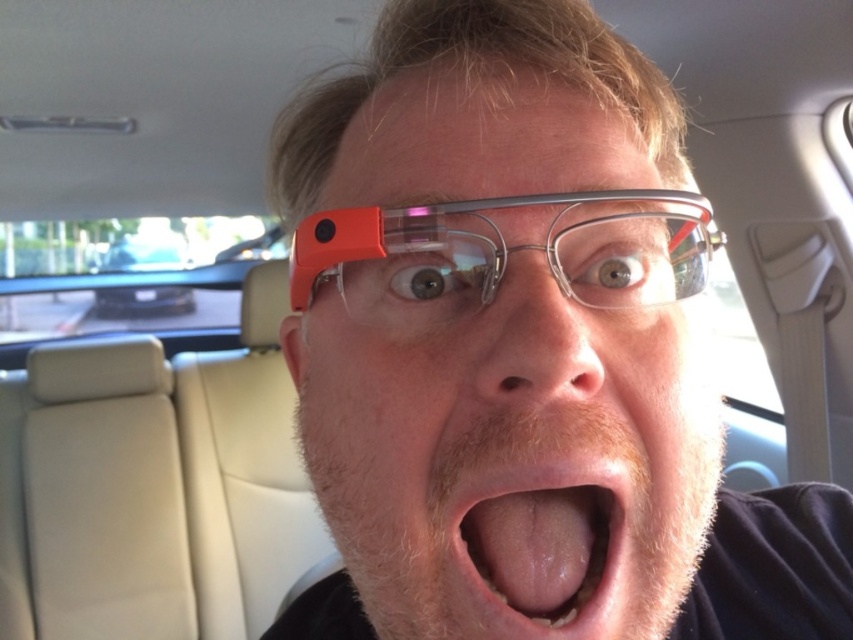
Based on the photo, is orange plastic google glass at center smaller than pink flesh at center?

No.

How far apart are orange plastic google glass at center and pink flesh at center?

A distance of 3.29 inches exists between orange plastic google glass at center and pink flesh at center.

Does point (685, 292) come closer to viewer compared to point (607, 518)?

That is False.

Find the location of a particular element. This screenshot has height=640, width=853. orange plastic google glass at center is located at coordinates (503, 252).

Can you confirm if matte orange glasses at center is positioned to the left of pink flesh at center?

Yes, matte orange glasses at center is to the left of pink flesh at center.

Is point (561, 321) more distant than point (461, 552)?

That is False.

I want to click on matte orange glasses at center, so click(x=506, y=449).

Is point (451, 330) positioned behind point (592, 221)?

No.

Can you confirm if matte orange glasses at center is positioned to the right of orange plastic google glass at center?

Incorrect, matte orange glasses at center is not on the right side of orange plastic google glass at center.

The image size is (853, 640). What are the coordinates of `matte orange glasses at center` in the screenshot? It's located at (506, 449).